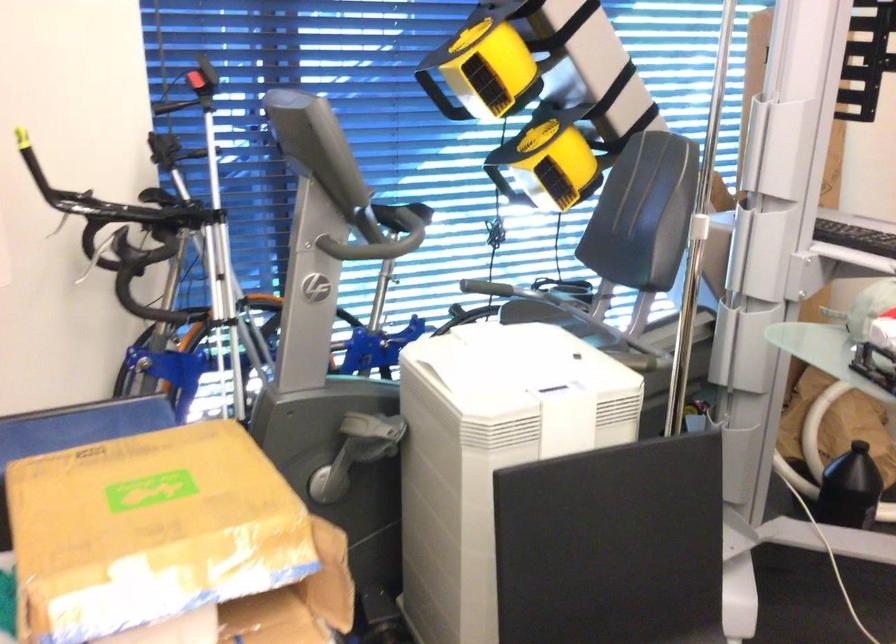
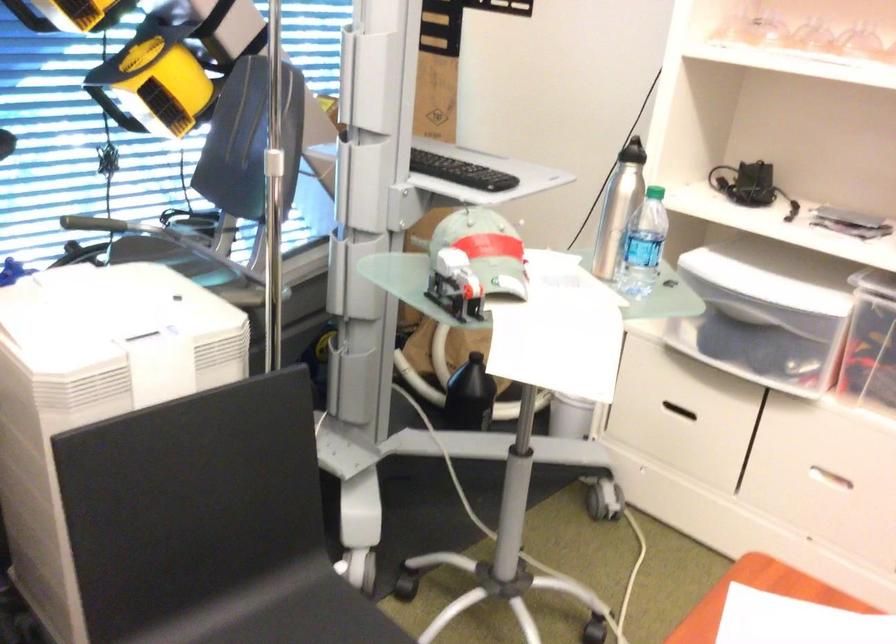
Find the pixel in the second image that matches (x=493, y=290) in the first image.

(97, 223)